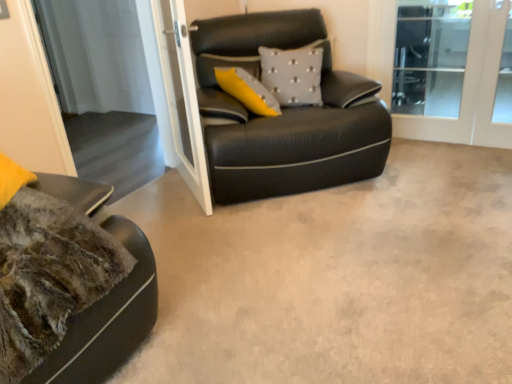
This screenshot has height=384, width=512. Find the location of `vacant space in front of black leather studio couch at center`. vacant space in front of black leather studio couch at center is located at coordinates (316, 245).